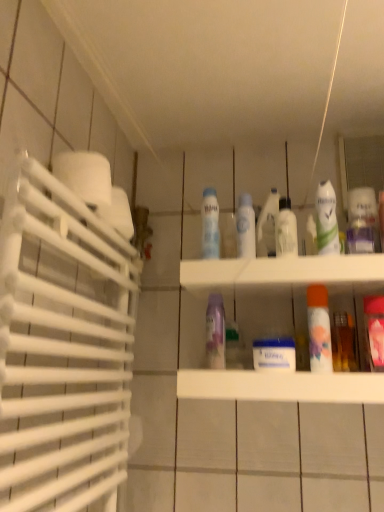
Question: Can you confirm if white matte spray can at center, positioned as the 5th cleaning product in right-to-left order, is bigger than orange matte mouthwash at center-right, which is the 2th mouthwash in right-to-left order?

Choices:
 (A) no
 (B) yes

Answer: (B)

Question: Is white matte spray can at center, which ranks as the 1th cleaning product in left-to-right order, shorter than orange matte mouthwash at center-right, placed as the 3th mouthwash when sorted from left to right?

Choices:
 (A) yes
 (B) no

Answer: (A)

Question: Can orange matte mouthwash at center-right, which is the 2th mouthwash in right-to-left order, be found inside white matte spray can at center, positioned as the 5th cleaning product in right-to-left order?

Choices:
 (A) yes
 (B) no

Answer: (B)

Question: Are white matte spray can at center, positioned as the 5th cleaning product in right-to-left order, and orange matte mouthwash at center-right, which is the 2th mouthwash in right-to-left order, far apart?

Choices:
 (A) yes
 (B) no

Answer: (B)

Question: Is white matte spray can at center, positioned as the 5th cleaning product in right-to-left order, outside orange matte mouthwash at center-right, which is the 2th mouthwash in right-to-left order?

Choices:
 (A) no
 (B) yes

Answer: (B)

Question: From a real-world perspective, is pink glossy mouthwash at right, placed as the 4th mouthwash when sorted from left to right, positioned above or below clear plastic bottle at center, arranged as the 3th mouthwash when viewed from the right?

Choices:
 (A) below
 (B) above

Answer: (A)

Question: Visually, is pink glossy mouthwash at right, which ranks as the 1th mouthwash in right-to-left order, positioned to the left or to the right of clear plastic bottle at center, arranged as the 3th mouthwash when viewed from the right?

Choices:
 (A) right
 (B) left

Answer: (A)

Question: Is pink glossy mouthwash at right, placed as the 4th mouthwash when sorted from left to right, situated inside clear plastic bottle at center, arranged as the 3th mouthwash when viewed from the right, or outside?

Choices:
 (A) outside
 (B) inside

Answer: (A)

Question: In terms of height, does pink glossy mouthwash at right, which ranks as the 1th mouthwash in right-to-left order, look taller or shorter compared to clear plastic bottle at center, the second mouthwash positioned from the left?

Choices:
 (A) short
 (B) tall

Answer: (B)

Question: Would you say translucent plastic spray bottle at center, the 3th cleaning product viewed from the right, is to the left or to the right of translucent plastic spray can at upper right, marked as the first cleaning product in a right-to-left arrangement, in the picture?

Choices:
 (A) left
 (B) right

Answer: (A)

Question: Is translucent plastic spray bottle at center, the 3th cleaning product positioned from the left, spatially inside translucent plastic spray can at upper right, acting as the 5th cleaning product starting from the left, or outside of it?

Choices:
 (A) inside
 (B) outside

Answer: (B)

Question: Relative to translucent plastic spray can at upper right, acting as the 5th cleaning product starting from the left, is translucent plastic spray bottle at center, the 3th cleaning product positioned from the left, in front or behind?

Choices:
 (A) behind
 (B) front

Answer: (A)

Question: In terms of size, does translucent plastic spray bottle at center, the 3th cleaning product viewed from the right, appear bigger or smaller than translucent plastic spray can at upper right, acting as the 5th cleaning product starting from the left?

Choices:
 (A) small
 (B) big

Answer: (A)

Question: Considering the positions of purple glossy spray can at center, acting as the second cleaning product starting from the left, and pink glossy mouthwash at right, placed as the 4th mouthwash when sorted from left to right, in the image, is purple glossy spray can at center, acting as the second cleaning product starting from the left, taller or shorter than pink glossy mouthwash at right, placed as the 4th mouthwash when sorted from left to right,?

Choices:
 (A) short
 (B) tall

Answer: (A)

Question: In the image, is purple glossy spray can at center, the fourth cleaning product in the right-to-left sequence, positioned in front of or behind pink glossy mouthwash at right, which ranks as the 1th mouthwash in right-to-left order?

Choices:
 (A) behind
 (B) front

Answer: (A)